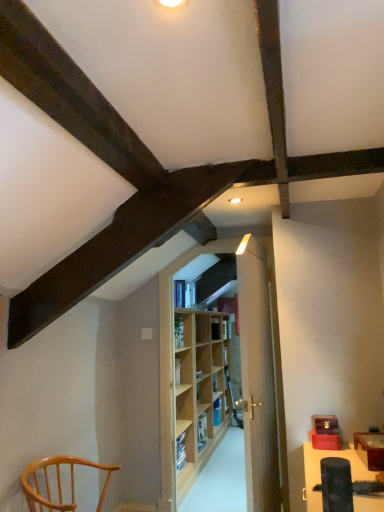
Question: Which direction should I rotate to look at wooden bookshelf at center, placed as the 1th shelf when sorted from bottom to top, — up or down?

Choices:
 (A) down
 (B) up

Answer: (A)

Question: Is black plastic lift at lower right not within wooden bookshelf at center, marked as the first shelf in a back-to-front arrangement?

Choices:
 (A) no
 (B) yes

Answer: (B)

Question: Considering the relative sizes of black plastic lift at lower right and wooden bookshelf at center, marked as the 2th shelf in a top-to-bottom arrangement, in the image provided, is black plastic lift at lower right bigger than wooden bookshelf at center, marked as the 2th shelf in a top-to-bottom arrangement,?

Choices:
 (A) no
 (B) yes

Answer: (A)

Question: Can you confirm if black plastic lift at lower right is shorter than wooden bookshelf at center, arranged as the 2th shelf when viewed from the left?

Choices:
 (A) yes
 (B) no

Answer: (A)

Question: Is wooden bookshelf at center, placed as the 1th shelf when sorted from bottom to top, located within black plastic lift at lower right?

Choices:
 (A) yes
 (B) no

Answer: (B)

Question: From the image's perspective, is black plastic lift at lower right over wooden bookshelf at center, positioned as the 2th shelf in front-to-back order?

Choices:
 (A) no
 (B) yes

Answer: (B)

Question: Is the surface of black plastic lift at lower right in direct contact with wooden bookshelf at center, placed as the 1th shelf when sorted from bottom to top?

Choices:
 (A) no
 (B) yes

Answer: (A)

Question: Are light brown wood chair at lower left and light wood door at center located far from each other?

Choices:
 (A) no
 (B) yes

Answer: (B)

Question: Considering the relative positions of light brown wood chair at lower left and light wood door at center in the image provided, is light brown wood chair at lower left to the left of light wood door at center from the viewer's perspective?

Choices:
 (A) yes
 (B) no

Answer: (A)

Question: Does light brown wood chair at lower left contain light wood door at center?

Choices:
 (A) no
 (B) yes

Answer: (A)

Question: Does light brown wood chair at lower left have a greater width compared to light wood door at center?

Choices:
 (A) no
 (B) yes

Answer: (B)

Question: Is light brown wood chair at lower left oriented away from light wood door at center?

Choices:
 (A) no
 (B) yes

Answer: (A)

Question: Is light brown wood chair at lower left located outside light wood door at center?

Choices:
 (A) yes
 (B) no

Answer: (A)

Question: Is wooden bookshelf at center, positioned as the 2th shelf in front-to-back order, a part of light wood door at center?

Choices:
 (A) no
 (B) yes

Answer: (A)